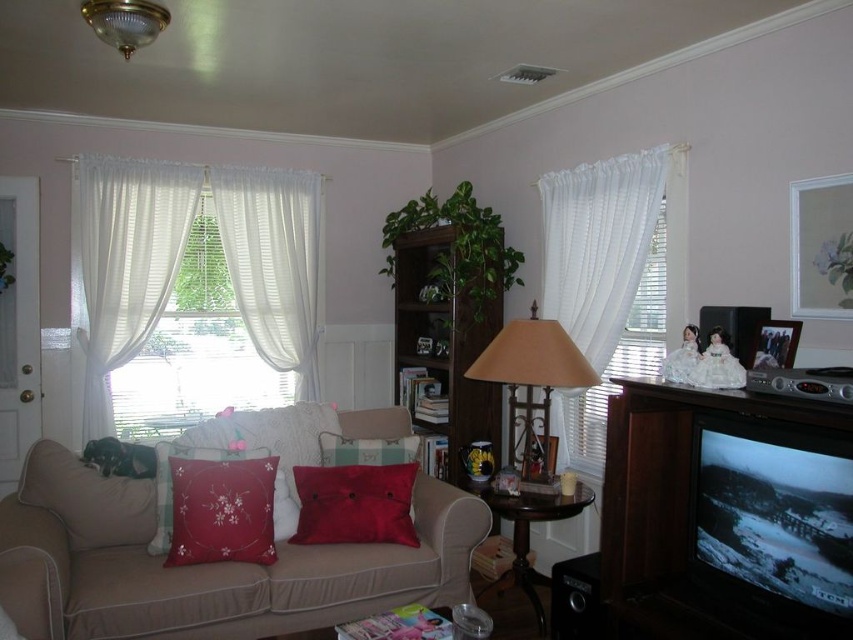
Looking at this image, does white sheer curtain at left have a greater width compared to silky red pillow at center?

Indeed, white sheer curtain at left has a greater width compared to silky red pillow at center.

Can you confirm if white sheer curtain at left is taller than silky red pillow at center?

Indeed, white sheer curtain at left has a greater height compared to silky red pillow at center.

Who is more distant from viewer, [309,266] or [384,472]?

The point [309,266] is more distant.

At what (x,y) coordinates should I click in order to perform the action: click on white sheer curtain at left. Please return your answer as a coordinate pair (x, y). Image resolution: width=853 pixels, height=640 pixels. Looking at the image, I should click on (274, 262).

Is point (590, 214) more distant than point (299, 520)?

Yes.

Can you confirm if white sheer curtains at right is thinner than silky red pillow at center?

Indeed, white sheer curtains at right has a lesser width compared to silky red pillow at center.

Describe the element at coordinates (608, 257) in the screenshot. I see `white sheer curtains at right` at that location.

This screenshot has width=853, height=640. Identify the location of white sheer curtains at right. (608, 257).

In the scene shown: Can you confirm if red satin pillow at lower left is bigger than wooden photo frame at upper right?

Yes.

Image resolution: width=853 pixels, height=640 pixels. Describe the element at coordinates (86, 499) in the screenshot. I see `red satin pillow at lower left` at that location.

Is point (115, 528) positioned after point (784, 332)?

Yes, it is.

Locate an element on the screen. red satin pillow at lower left is located at coordinates (86, 499).